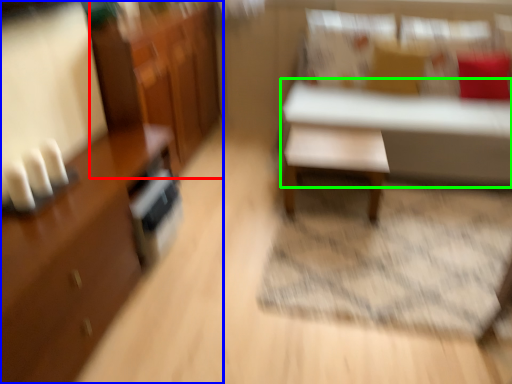
Question: Which object is positioned farthest from dresser (highlighted by a red box)? Select from cabinetry (highlighted by a blue box) and table (highlighted by a green box).

Choices:
 (A) cabinetry
 (B) table

Answer: (B)